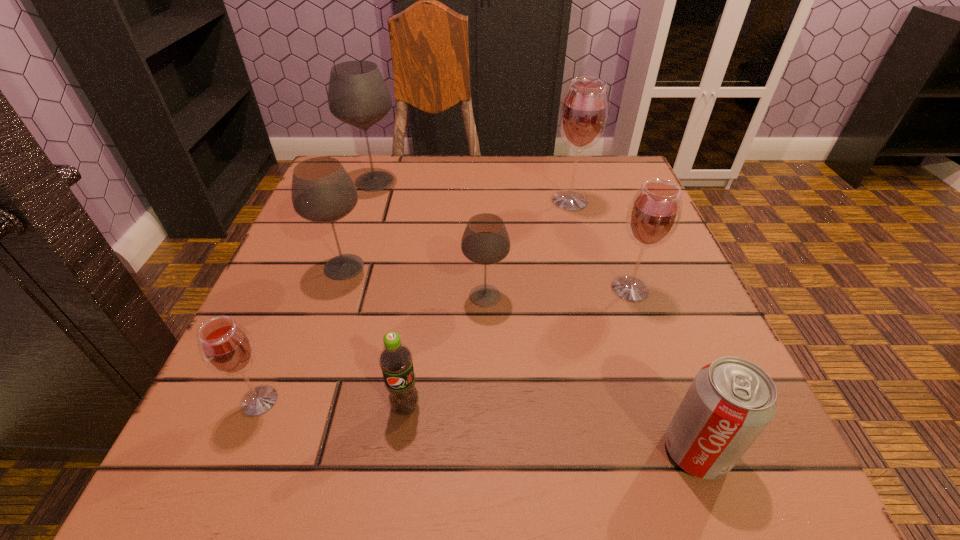
The height and width of the screenshot is (540, 960). I want to click on free space that satisfies the following two spatial constraints: 1. on the front side of the farthest gray wineglass; 2. on the right side of the second farthest red wineglass, so click(x=339, y=288).

The width and height of the screenshot is (960, 540). Identify the location of vacant point that satisfies the following two spatial constraints: 1. on the front side of the nearer soda can; 2. on the left side of the second smallest gray wineglass. (282, 450).

Identify the location of vacant area that satisfies the following two spatial constraints: 1. on the back side of the second smallest gray wineglass; 2. on the right side of the biggest gray wineglass. The height and width of the screenshot is (540, 960). (373, 181).

The image size is (960, 540). I want to click on free spot that satisfies the following two spatial constraints: 1. on the front label of the green soda; 2. on the right side of the right soda can, so click(x=399, y=450).

I want to click on blank area in the image that satisfies the following two spatial constraints: 1. on the front side of the farthest gray wineglass; 2. on the right side of the second biggest red wineglass, so click(x=339, y=288).